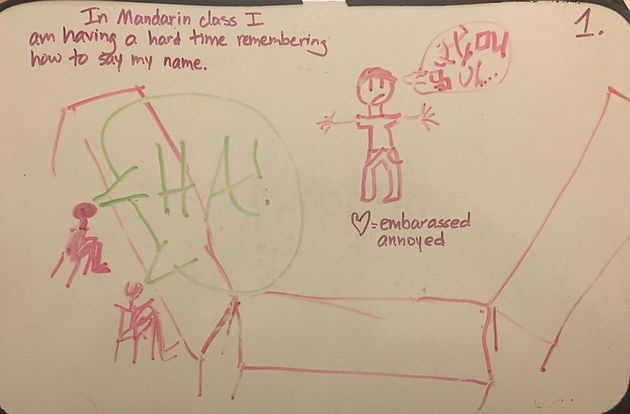
At what (x,y) coordinates should I click in order to perform the action: click on rocking chair around. Please return your answer as a coordinate pair (x, y). Looking at the image, I should click on (81, 252).